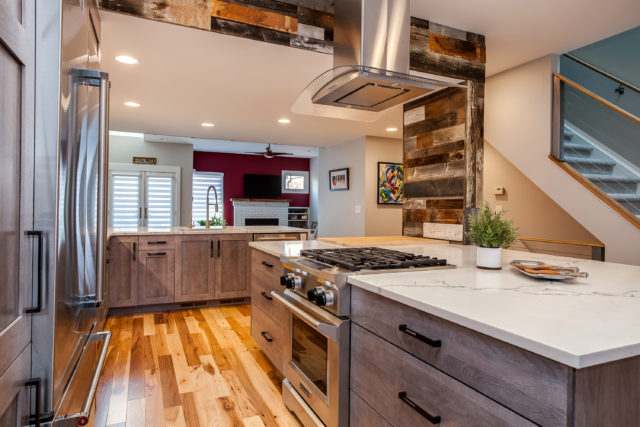
Locate an element on the screen. Image resolution: width=640 pixels, height=427 pixels. ceiling lights is located at coordinates (130, 62), (132, 103), (208, 125), (283, 119), (395, 126).